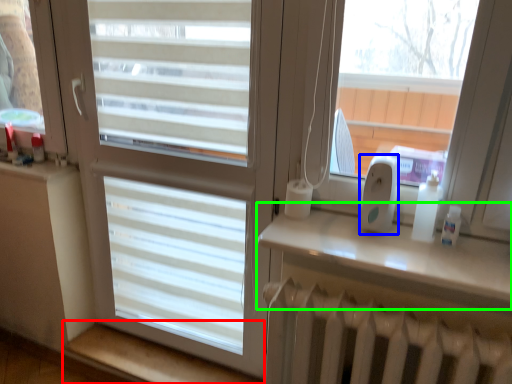
Question: Considering the real-world distances, which object is closest to window sill (highlighted by a red box)? ipod (highlighted by a blue box) or window sill (highlighted by a green box).

Choices:
 (A) ipod
 (B) window sill

Answer: (B)